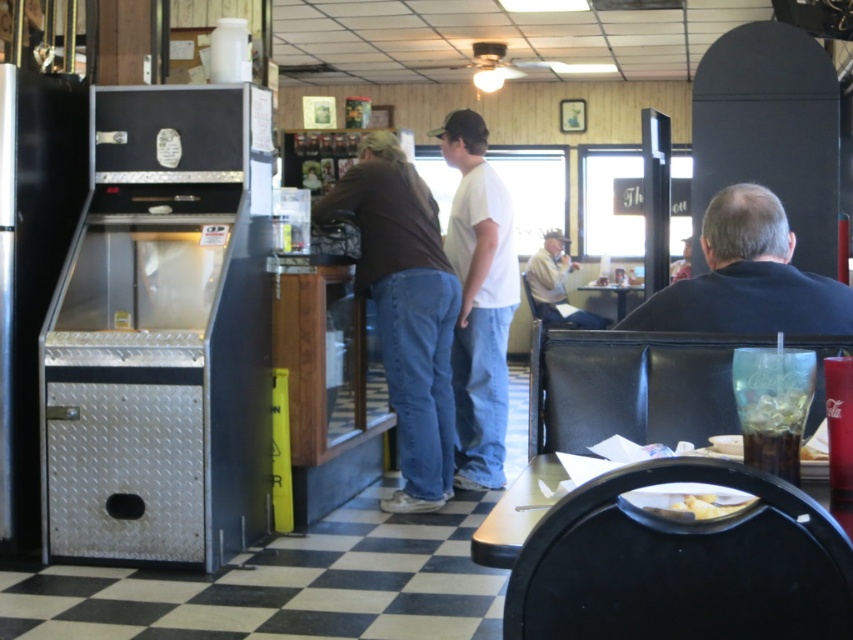
Is gray fabric shirt at center smaller than white matte plate at lower center?

No, gray fabric shirt at center is not smaller than white matte plate at lower center.

Which of these two, gray fabric shirt at center or white matte plate at lower center, stands taller?

gray fabric shirt at center is taller.

Image resolution: width=853 pixels, height=640 pixels. Identify the location of gray fabric shirt at center. (556, 285).

At what (x,y) coordinates should I click in order to perform the action: click on gray fabric shirt at center. Please return your answer as a coordinate pair (x, y). The width and height of the screenshot is (853, 640). Looking at the image, I should click on (556, 285).

Can you confirm if dark blue shirt at right is positioned above translucent plastic cup at lower right?

Correct, dark blue shirt at right is located above translucent plastic cup at lower right.

Locate an element on the screen. The width and height of the screenshot is (853, 640). dark blue shirt at right is located at coordinates point(747,276).

Can you confirm if brown cotton shirt at center is smaller than translucent plastic cup at lower right?

Actually, brown cotton shirt at center might be larger than translucent plastic cup at lower right.

Is brown cotton shirt at center thinner than translucent plastic cup at lower right?

In fact, brown cotton shirt at center might be wider than translucent plastic cup at lower right.

Which is behind, point (376, 243) or point (804, 456)?

Positioned behind is point (376, 243).

Find the location of a particular element. This screenshot has width=853, height=640. brown cotton shirt at center is located at coordinates (415, 317).